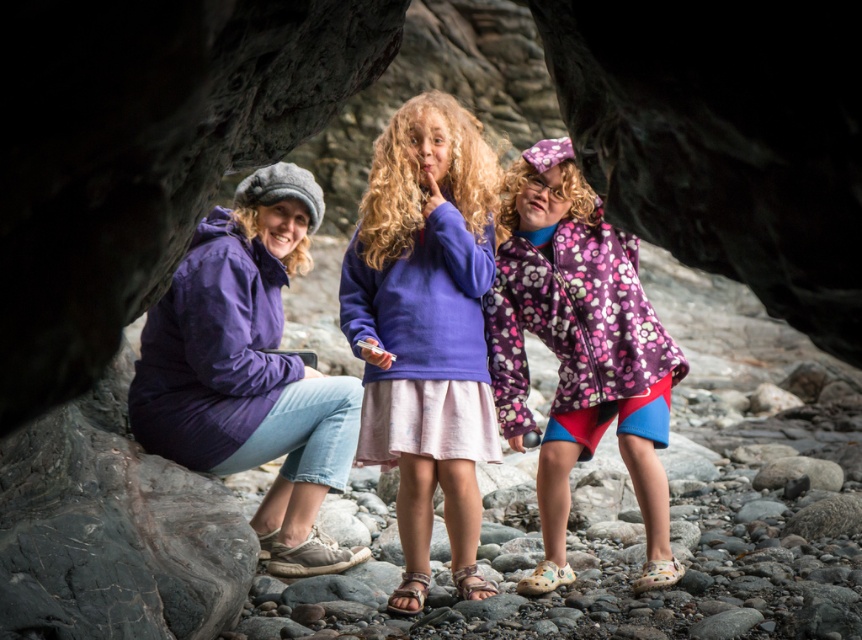
In the scene shown: Does purple fleece jacket at center have a lesser width compared to floral fleece jacket at center?

Yes.

Is purple fleece jacket at center wider than floral fleece jacket at center?

In fact, purple fleece jacket at center might be narrower than floral fleece jacket at center.

The image size is (862, 640). What do you see at coordinates (426, 328) in the screenshot?
I see `purple fleece jacket at center` at bounding box center [426, 328].

At what (x,y) coordinates should I click in order to perform the action: click on purple fleece jacket at center. Please return your answer as a coordinate pair (x, y). The image size is (862, 640). Looking at the image, I should click on (426, 328).